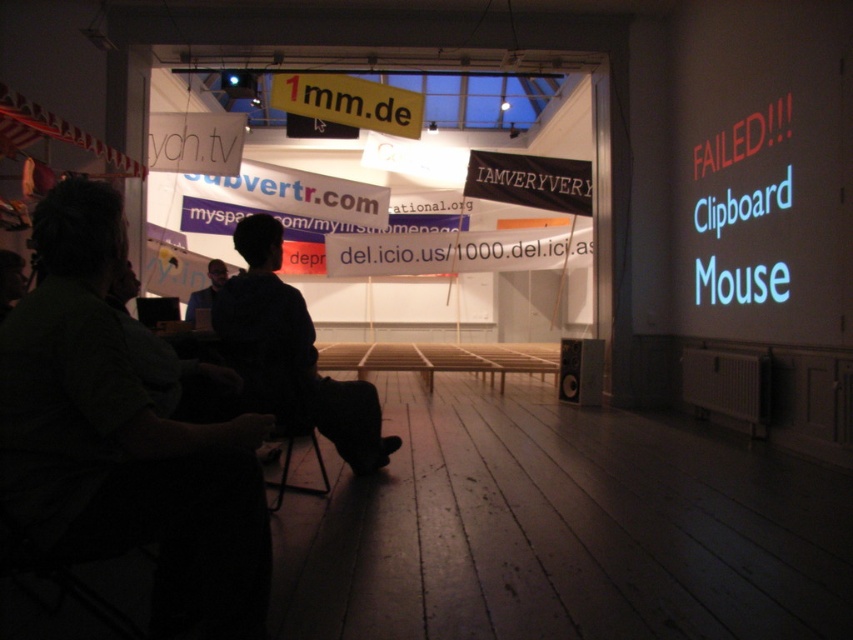
Who is more forward, (370, 452) or (184, 308)?

Positioned in front is point (370, 452).

Which of these two, dark blue shirt at center or dark green shirt at center, stands shorter?

dark green shirt at center is shorter.

Measure the distance between point (233, 346) and camera.

3.43 meters

Find the location of a particular element. Image resolution: width=853 pixels, height=640 pixels. dark blue shirt at center is located at coordinates (291, 352).

Which is behind, point (254, 602) or point (260, 212)?

The point (260, 212) is more distant.

Which of these two, dark green shirt at left or dark blue shirt at center, stands shorter?

dark green shirt at left is shorter.

What do you see at coordinates (122, 436) in the screenshot? The height and width of the screenshot is (640, 853). I see `dark green shirt at left` at bounding box center [122, 436].

Find the location of a particular element. dark green shirt at left is located at coordinates (122, 436).

Is dark green shirt at left positioned in front of dark green shirt at center?

Yes.

Can you confirm if dark green shirt at left is taller than dark green shirt at center?

Yes, dark green shirt at left is taller than dark green shirt at center.

What do you see at coordinates (122, 436) in the screenshot?
I see `dark green shirt at left` at bounding box center [122, 436].

Image resolution: width=853 pixels, height=640 pixels. Find the location of `dark green shirt at left`. dark green shirt at left is located at coordinates (122, 436).